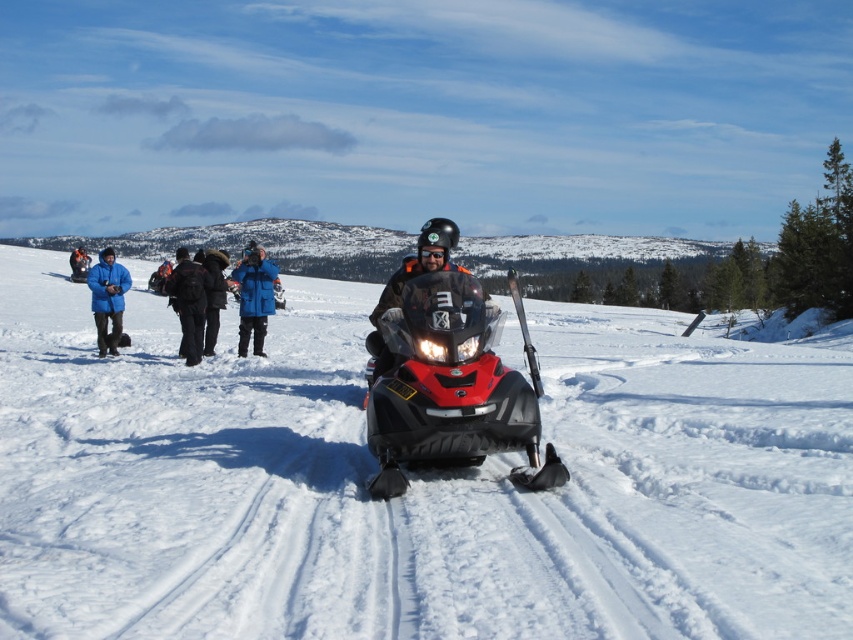
You are a photographer trying to capture a group photo of the people in the snowy scene. You notice two jackets at the center of the image, a blue fabric jacket at center and a dark blue jacket at center. Which jacket should you focus on to ensure it takes up more of the frame?

The dark blue jacket at center occupies more space than the blue fabric jacket at center, so focusing on the dark blue jacket at center will ensure it takes up more of the frame.

You are a hiker who wants to place your black backpack at center on the snowmobile. The snowmobile is at coordinates 0.5, 0.5. Can you reach the snowmobile from the backpack?

The black backpack at center is located at point [189,301], while the snowmobile is at [426,320]. Since the coordinates are close but not overlapping, you can reach the snowmobile from the backpack by moving it slightly.

You are a photographer standing at the center of the snowy scene. You want to take a photo of the blue fleece jacket at left. Where should you point your camera?

You should point your camera to the left at point coordinates [107,300] to capture the blue fleece jacket at left.